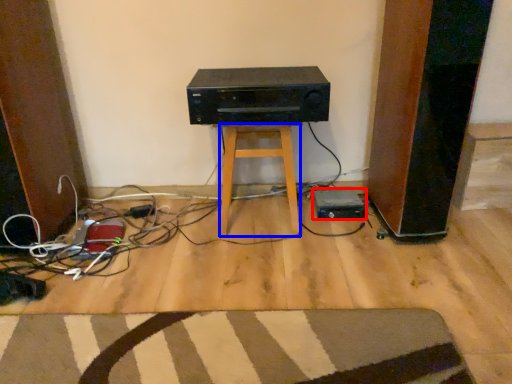
Question: Among these objects, which one is nearest to the camera, appliance (highlighted by a red box) or stool (highlighted by a blue box)?

Choices:
 (A) appliance
 (B) stool

Answer: (B)